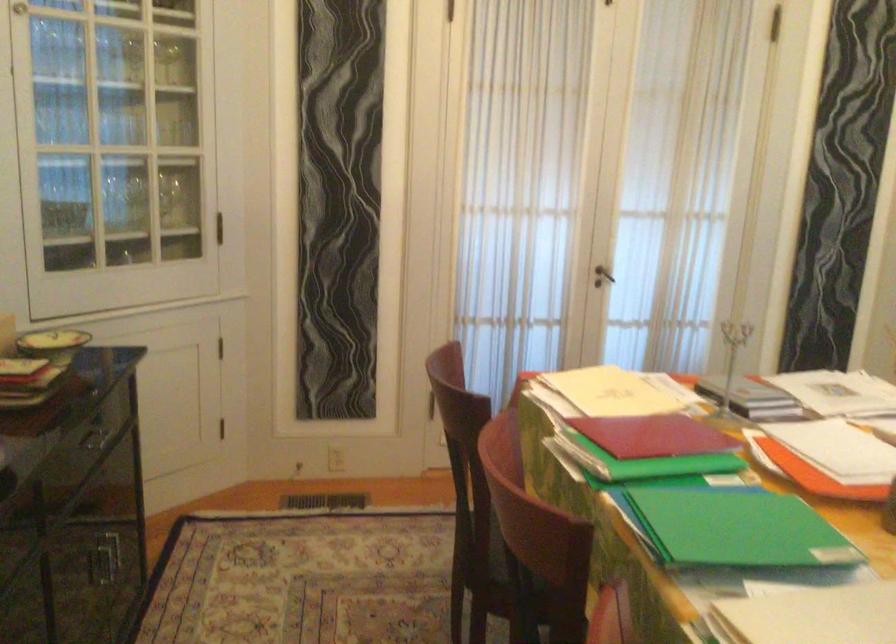
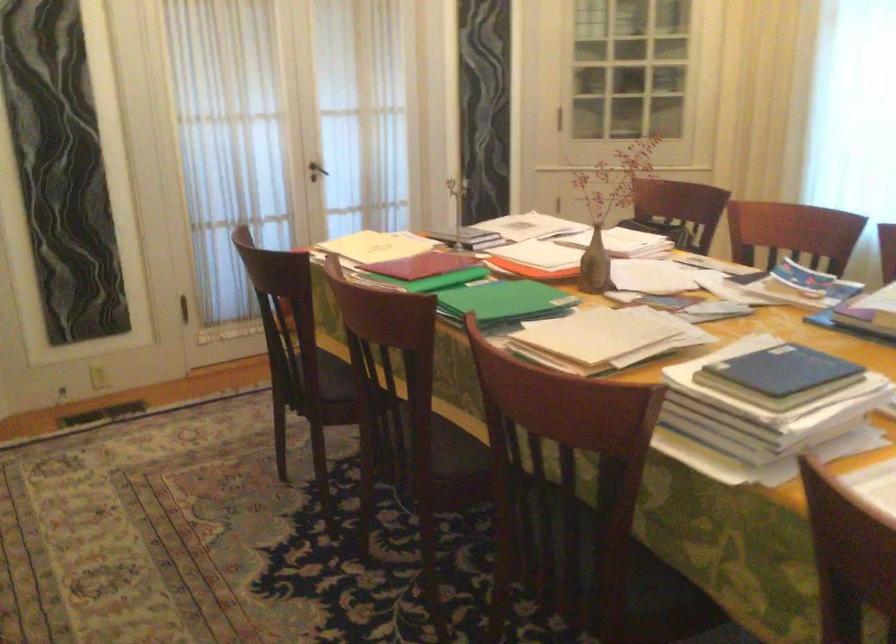
Find the pixel in the second image that matches point (615, 393) in the first image.

(376, 245)